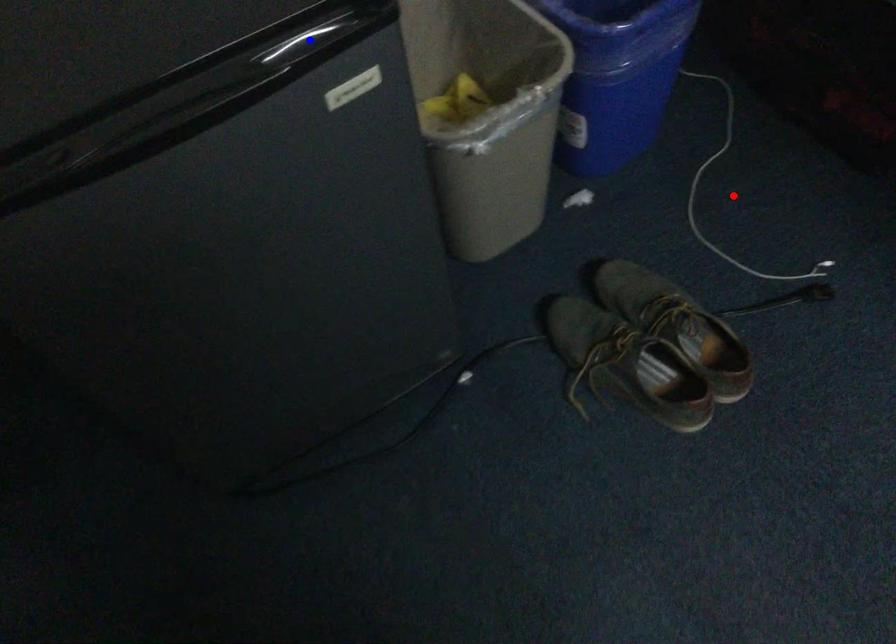
Question: Two points are marked on the image. Which point is closer to the camera?

Choices:
 (A) Blue point is closer.
 (B) Red point is closer.

Answer: (A)